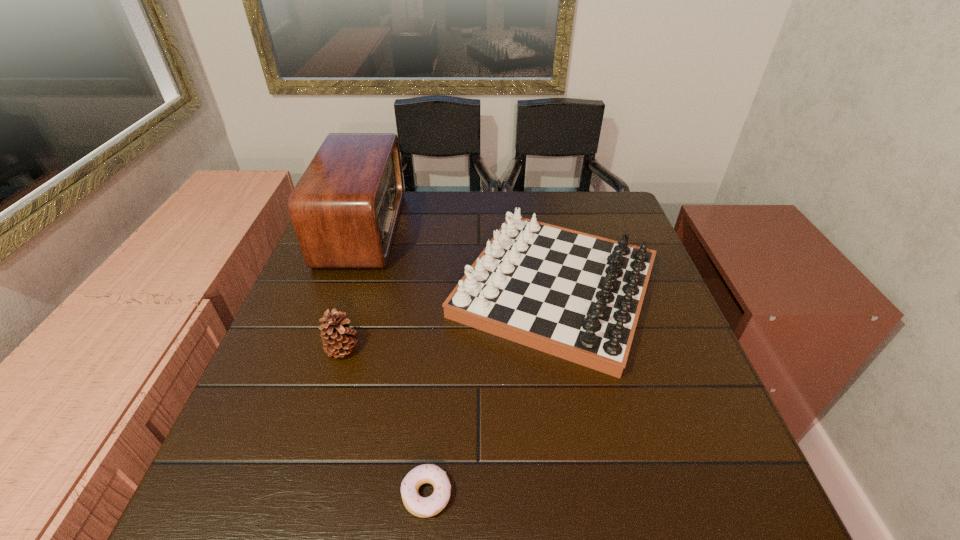
In the image, there is a desktop. Identify the location of vacant space at the right edge. (703, 400).

This screenshot has width=960, height=540. In order to click on free spot at the far right corner of the desktop in this screenshot , I will do `click(624, 230)`.

Where is `vacant point located between the radio receiver and the pinecone`? Image resolution: width=960 pixels, height=540 pixels. vacant point located between the radio receiver and the pinecone is located at coordinates (352, 289).

Locate an element on the screen. This screenshot has width=960, height=540. vacant area that lies between the nearest object and the gameboard is located at coordinates (491, 392).

Identify the location of free spot between the radio receiver and the nearest object. (395, 361).

Where is `unoccupied position between the tallest object and the pinecone`? unoccupied position between the tallest object and the pinecone is located at coordinates (352, 289).

Where is `vacant area between the pinecone and the radio receiver`? This screenshot has height=540, width=960. vacant area between the pinecone and the radio receiver is located at coordinates (352, 289).

The width and height of the screenshot is (960, 540). Find the location of `free spot between the nearest object and the gameboard`. free spot between the nearest object and the gameboard is located at coordinates (491, 392).

Identify the location of vacant area that lies between the gameboard and the tallest object. This screenshot has width=960, height=540. (459, 259).

This screenshot has width=960, height=540. Identify the location of vacant space that's between the gameboard and the doughnut. (491, 392).